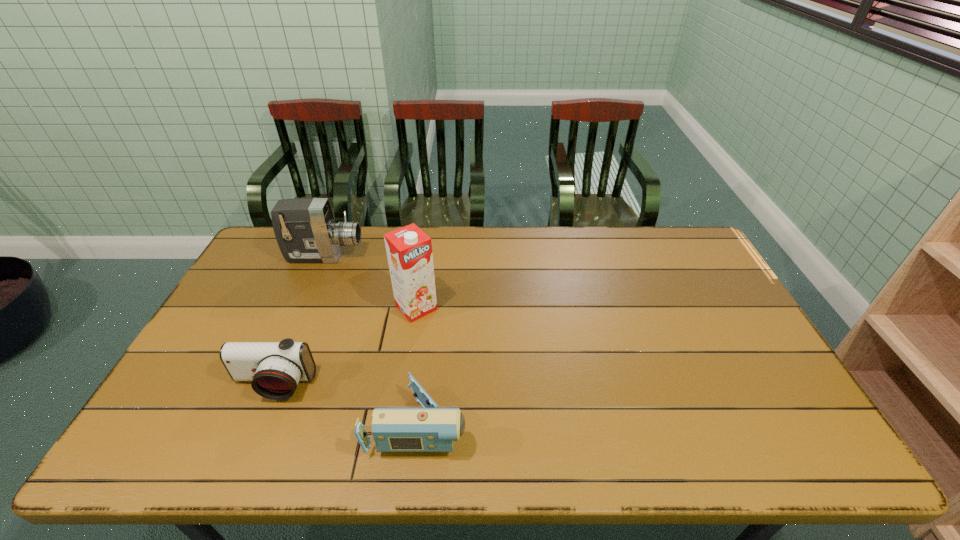
Locate an element on the screen. The image size is (960, 540). vacant area between the carton and the farthest camcorder is located at coordinates (371, 282).

Find the location of a particular element. empty space that is in between the rightmost camcorder and the tallest camcorder is located at coordinates (372, 340).

At what (x,y) coordinates should I click in order to perform the action: click on object that is the third nearest to the farthest object. Please return your answer as a coordinate pair (x, y). This screenshot has width=960, height=540. Looking at the image, I should click on (429, 429).

Find the location of `object that can be found as the third closest to the farthest camcorder`. object that can be found as the third closest to the farthest camcorder is located at coordinates (429, 429).

Identify which camcorder is located as the nearest to the rightmost camcorder. Please provide its 2D coordinates. Your answer should be formatted as a tuple, i.e. [(x, y)], where the tuple contains the x and y coordinates of a point satisfying the conditions above.

[(275, 368)]

Where is `the second closest camcorder relative to the second tallest object`? the second closest camcorder relative to the second tallest object is located at coordinates (429, 429).

Where is `free point that satisfies the following two spatial constraints: 1. at the front of the tallest camcorder, highlighting the lens; 2. on the left side of the second farthest object`? free point that satisfies the following two spatial constraints: 1. at the front of the tallest camcorder, highlighting the lens; 2. on the left side of the second farthest object is located at coordinates (303, 307).

Where is `vacant space that satisfies the following two spatial constraints: 1. at the front of the tallest camcorder, highlighting the lens; 2. on the back side of the third nearest object`? vacant space that satisfies the following two spatial constraints: 1. at the front of the tallest camcorder, highlighting the lens; 2. on the back side of the third nearest object is located at coordinates (303, 307).